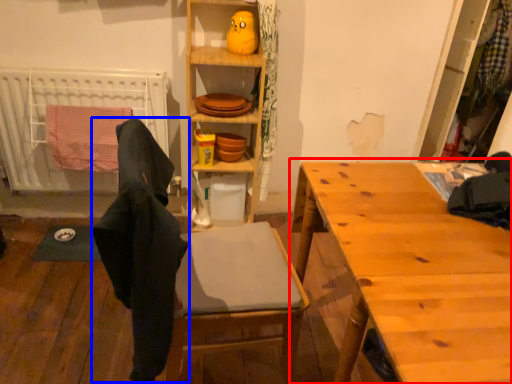
Question: Among these objects, which one is nearest to the camera, table (highlighted by a red box) or clothing (highlighted by a blue box)?

Choices:
 (A) table
 (B) clothing

Answer: (A)